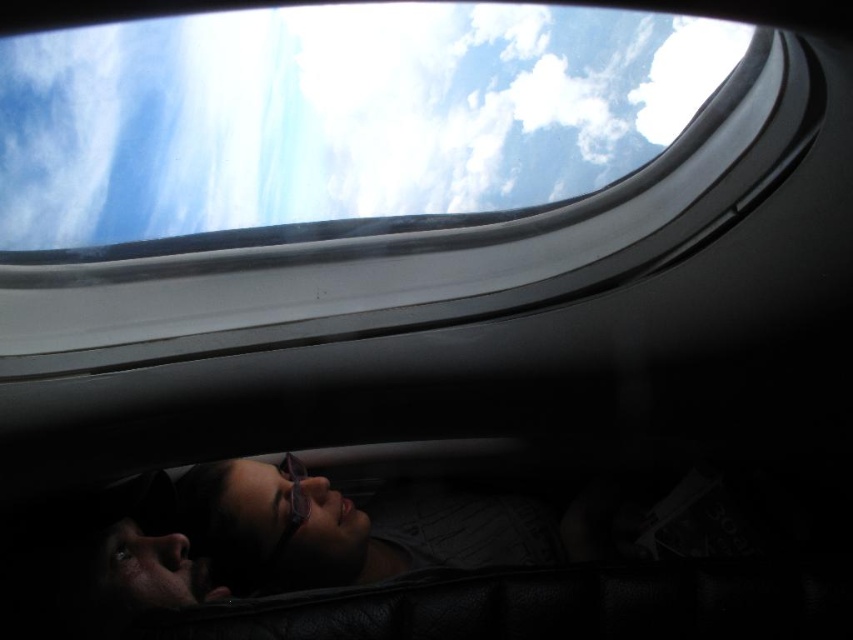
You are a passenger sitting in the airplane cabin and looking out the window. You see the white fluffy cloud at upper center. Can you estimate the coordinates of the cloud in the window frame?

The white fluffy cloud at upper center is located at coordinates point [335,115] in the window frame.

You are a passenger on an airplane and you want to take a photo of the white fluffy cloud at upper center and the matte black goggles at lower center through the window. Can you fit both objects in the frame at the same time?

The white fluffy cloud at upper center is much taller than the matte black goggles at lower center, so it depends on the camera angle and zoom level. If the camera can adjust to capture the height difference, both might fit, but if not, the cloud might dominate the frame.

You are a flight attendant checking the cabin. You notice the white fluffy cloud at upper center and the matte black goggles at lower center. Which object is wider?

The white fluffy cloud at upper center is wider than the matte black goggles at lower center.